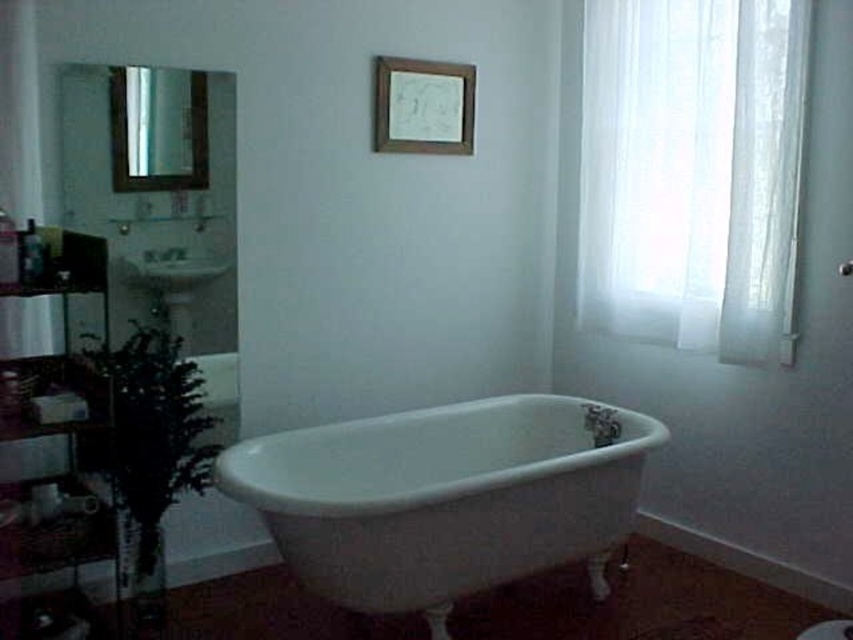
You are standing in the bathroom and want to reach both the point at coordinates point (706, 259) and point (399, 100). Which point should you reach first if you want to touch them in order from closest to farthest?

You should reach point (706, 259) first because it is closer to you than point (399, 100).

You are standing in the bathroom and want to locate the translucent fabric curtain at right. According to the scene description, where would you expect to find it?

The translucent fabric curtain at right is located at the right side of the bathroom, specifically at the 2D coordinate point of (693, 170).

You are standing in the bathroom and want to determine which of the two points, point (294, 509) or point (183, 280), is closer to you. Based on the scene, which point is nearer?

Point (294, 509) is closer to the camera than point (183, 280), so it is nearer to you.